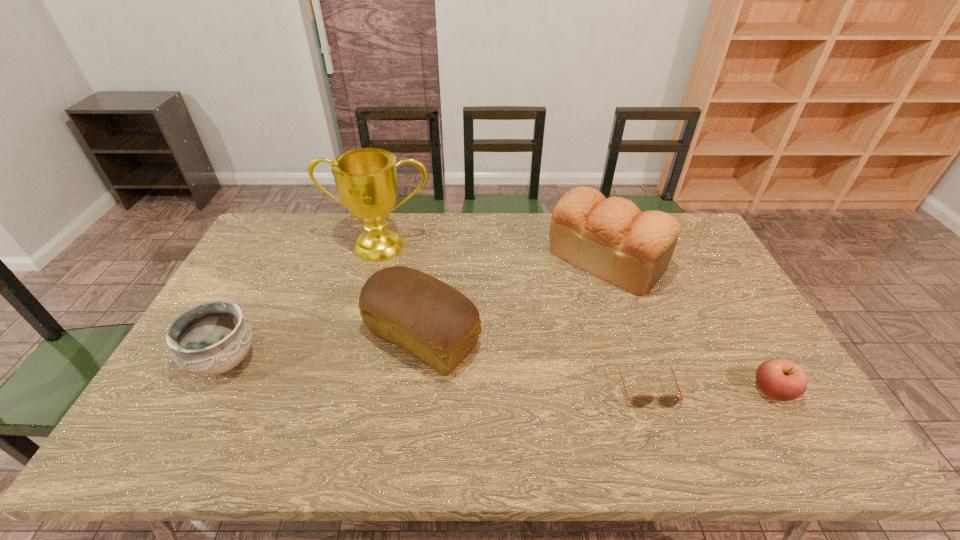
Where is `free spot at the far edge of the desktop`? free spot at the far edge of the desktop is located at coordinates (549, 222).

Where is `free point at the left edge`? The width and height of the screenshot is (960, 540). free point at the left edge is located at coordinates (242, 295).

In the image, there is a desktop. Where is `free region at the right edge`? Image resolution: width=960 pixels, height=540 pixels. free region at the right edge is located at coordinates (745, 408).

The width and height of the screenshot is (960, 540). I want to click on free space at the far left corner, so click(x=300, y=244).

The height and width of the screenshot is (540, 960). In the image, there is a desktop. Find the location of `vacant space at the far right corner`. vacant space at the far right corner is located at coordinates (691, 225).

Identify the location of unoccupied area between the shorter bread and the sunglasses. (534, 361).

Locate an element on the screen. blank region between the sunglasses and the award is located at coordinates (513, 315).

This screenshot has width=960, height=540. Find the location of `free point between the rightmost object and the tallest object`. free point between the rightmost object and the tallest object is located at coordinates (577, 319).

Identify the location of free point between the pottery and the award. This screenshot has width=960, height=540. (303, 303).

Locate an element on the screen. The width and height of the screenshot is (960, 540). free area in between the pottery and the apple is located at coordinates (499, 376).